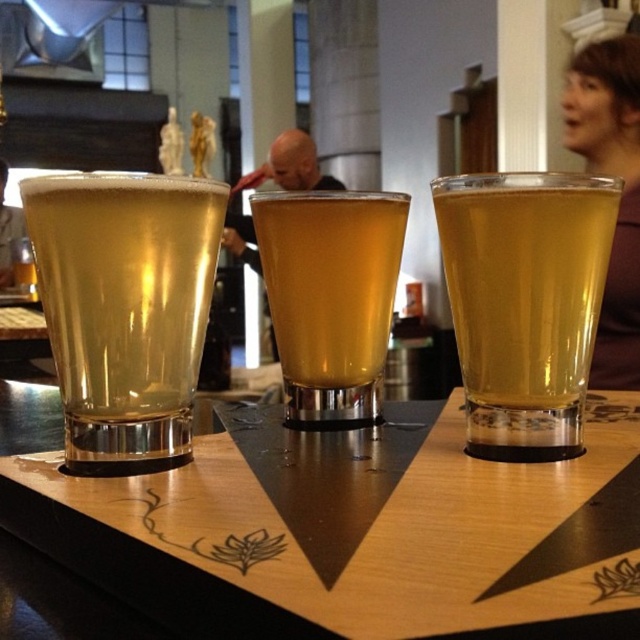
Question: Does wooden tray at center have a lesser width compared to matte black laptop at left?

Choices:
 (A) no
 (B) yes

Answer: (A)

Question: Is translucent glass at center to the right of matte black laptop at left from the viewer's perspective?

Choices:
 (A) yes
 (B) no

Answer: (A)

Question: Which of the following is the closest to the observer?

Choices:
 (A) translucent glass beer at center
 (B) bald head at center
 (C) brown fabric shirt at upper right

Answer: (A)

Question: Is wooden tray at center positioned behind translucent glass at left?

Choices:
 (A) no
 (B) yes

Answer: (A)

Question: Which of the following is the closest to the observer?

Choices:
 (A) bald head at center
 (B) brown fabric shirt at upper right
 (C) wooden tray at center
 (D) translucent glass beer at center

Answer: (C)

Question: Estimate the real-world distances between objects in this image. Which object is closer to the wooden tray at center?

Choices:
 (A) translucent glass beer at center
 (B) translucent glass at center
 (C) translucent glass at left

Answer: (B)